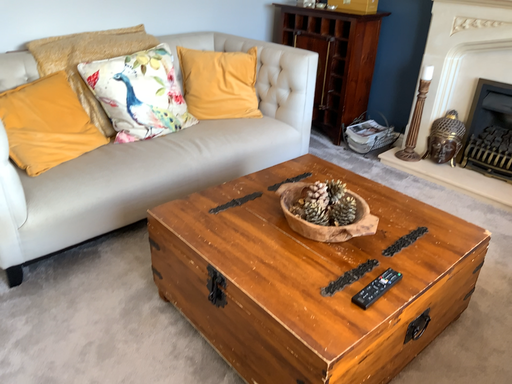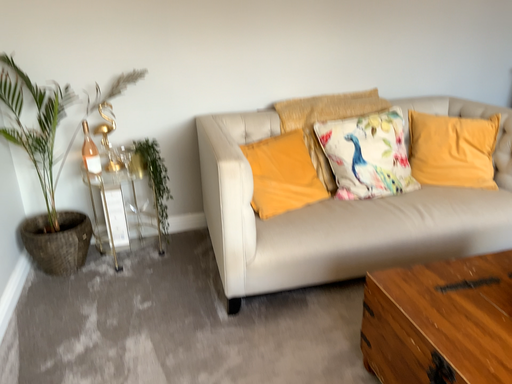
Question: How did the camera likely rotate when shooting the video?

Choices:
 (A) rotated left
 (B) rotated right

Answer: (A)